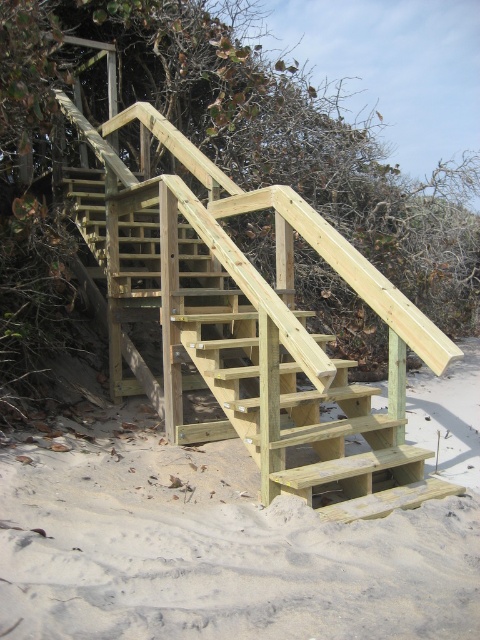
You are standing on the beach and see the light brown wood stairs at center and the natural wood stairs at center. Which one is positioned to the right side?

The light brown wood stairs at center are positioned to the right of the natural wood stairs at center.

You are standing at the base of the wooden staircase on the sandy beach. You see two points marked on the staircase structure. The first point is at coordinate point (99,518) and the second is at point (357,273). If you were to walk towards the vegetation area behind the staircase, which point would you encounter first?

Point (99,518) is in front of point (357,273), so you would encounter point (99,518) first as you walk towards the vegetation area behind the staircase.